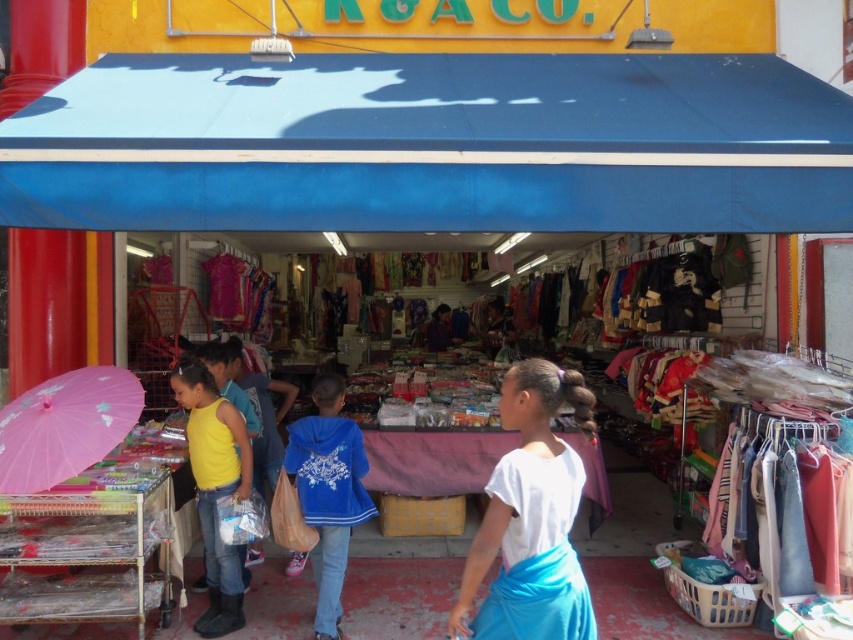
Which of these two, white matte shirt at center or yellow matte tank top at lower left, stands taller?

Standing taller between the two is yellow matte tank top at lower left.

Find the location of a particular element. This screenshot has width=853, height=640. white matte shirt at center is located at coordinates (531, 518).

You are a GUI agent. You are given a task and a screenshot of the screen. Output one action in this format:
    pyautogui.click(x=<x>, y=<y>)
    Task: Click on the white matte shirt at center
    This screenshot has height=640, width=853.
    Given the screenshot: What is the action you would take?
    pyautogui.click(x=531, y=518)

Is pink paper umbrella at left smaller than yellow matte tank top at lower left?

No, pink paper umbrella at left is not smaller than yellow matte tank top at lower left.

Can you confirm if pink paper umbrella at left is positioned below yellow matte tank top at lower left?

No.

Image resolution: width=853 pixels, height=640 pixels. I want to click on pink paper umbrella at left, so click(65, 426).

Can you confirm if blue fabric canopy at upper center is taller than white matte shirt at center?

Yes.

Is blue fabric canopy at upper center in front of white matte shirt at center?

No, blue fabric canopy at upper center is further to the viewer.

Is point (437, 196) positioned before point (527, 637)?

No, it is not.

Where is `blue fabric canopy at upper center`? Image resolution: width=853 pixels, height=640 pixels. blue fabric canopy at upper center is located at coordinates (432, 145).